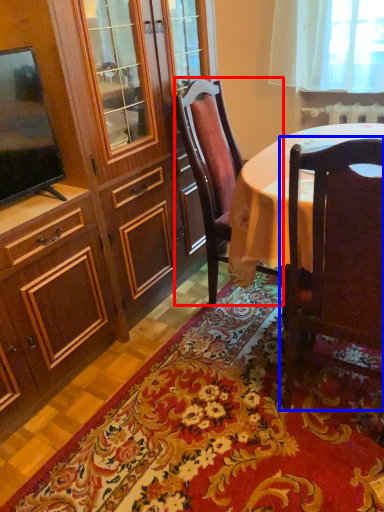
Question: Which point is further to the camera, chair (highlighted by a red box) or chair (highlighted by a blue box)?

Choices:
 (A) chair
 (B) chair

Answer: (A)